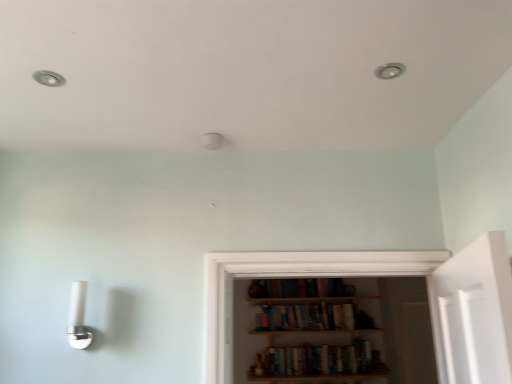
You are a GUI agent. You are given a task and a screenshot of the screen. Output one action in this format:
    pyautogui.click(x=<x>, y=<y>)
    Task: Click on the white glossy sconce at lower left
    The width and height of the screenshot is (512, 384).
    Given the screenshot: What is the action you would take?
    pyautogui.click(x=78, y=317)

Identify the location of hardcover books at center, placed as the first book when sorted from top to bottom. (309, 317).

How far apart are hardcover books at center, the 1th book ordered from the bottom, and matte white light fixture at upper left?

hardcover books at center, the 1th book ordered from the bottom, and matte white light fixture at upper left are 9.74 feet apart from each other.

Considering the relative sizes of hardcover books at center, the 1th book ordered from the bottom, and matte white light fixture at upper left in the image provided, is hardcover books at center, the 1th book ordered from the bottom, smaller than matte white light fixture at upper left?

Incorrect, hardcover books at center, the 1th book ordered from the bottom, is not smaller in size than matte white light fixture at upper left.

Which is in front, point (313, 374) or point (42, 77)?

Positioned in front is point (42, 77).

From a real-world perspective, which object stands above the other?

From a 3D spatial view, matte white light fixture at upper left is above.

I want to click on book above the hardcover books at center, marked as the 2th book in a top-to-bottom arrangement (from a real-world perspective), so click(x=309, y=317).

Are hardcover books at center, the 1th book ordered from the bottom, and hardcover books at center, the 2th book when ordered from bottom to top, far apart?

No.

Can you tell me how much hardcover books at center, marked as the 2th book in a top-to-bottom arrangement, and hardcover books at center, placed as the first book when sorted from top to bottom, differ in facing direction?

There is a 1.56-degree angle between the facing directions of hardcover books at center, marked as the 2th book in a top-to-bottom arrangement, and hardcover books at center, placed as the first book when sorted from top to bottom.

Identify the location of dot on the left of hardcover books at center, placed as the first book when sorted from top to bottom. (48, 78).

From a real-world perspective, is matte white light fixture at upper left below hardcover books at center, placed as the first book when sorted from top to bottom?

No, from a real-world perspective, matte white light fixture at upper left is not below hardcover books at center, placed as the first book when sorted from top to bottom.

Is matte white light fixture at upper left wider than hardcover books at center, the 2th book when ordered from bottom to top?

No, matte white light fixture at upper left is not wider than hardcover books at center, the 2th book when ordered from bottom to top.

Based on the photo, who is shorter, white glossy sconce at lower left or hardcover books at center, the 2th book when ordered from bottom to top?

Standing shorter between the two is hardcover books at center, the 2th book when ordered from bottom to top.

From the image's perspective, would you say white glossy sconce at lower left is positioned over hardcover books at center, placed as the first book when sorted from top to bottom?

Yes, from the image's perspective, white glossy sconce at lower left is on top of hardcover books at center, placed as the first book when sorted from top to bottom.

Is the position of white glossy sconce at lower left less distant than that of hardcover books at center, placed as the first book when sorted from top to bottom?

Yes, white glossy sconce at lower left is in front of hardcover books at center, placed as the first book when sorted from top to bottom.

Identify the location of light fixture to the left of hardcover books at center, the 2th book when ordered from bottom to top. The height and width of the screenshot is (384, 512). (78, 317).

Does point (73, 283) come closer to viewer compared to point (337, 356)?

Yes, point (73, 283) is closer to viewer.

From a real-world perspective, is white glossy sconce at lower left positioned under hardcover books at center, the 1th book ordered from the bottom, based on gravity?

No.

Between white glossy sconce at lower left and hardcover books at center, marked as the 2th book in a top-to-bottom arrangement, which one has larger size?

With larger size is hardcover books at center, marked as the 2th book in a top-to-bottom arrangement.

Based on the photo, from the image's perspective, is white glossy sconce at lower left under hardcover books at center, marked as the 2th book in a top-to-bottom arrangement?

Actually, white glossy sconce at lower left appears above hardcover books at center, marked as the 2th book in a top-to-bottom arrangement, in the image.

Considering the relative sizes of white glossy sconce at lower left and matte white light fixture at upper left in the image provided, is white glossy sconce at lower left taller than matte white light fixture at upper left?

Yes.

Is white glossy sconce at lower left positioned with its back to matte white light fixture at upper left?

No, white glossy sconce at lower left's orientation is not away from matte white light fixture at upper left.

Locate an element on the screen. light fixture behind the matte white light fixture at upper left is located at coordinates (78, 317).

Which point is more forward, (83, 333) or (36, 72)?

Point (36, 72)

Are hardcover books at center, placed as the first book when sorted from top to bottom, and matte white light fixture at upper left beside each other?

hardcover books at center, placed as the first book when sorted from top to bottom, and matte white light fixture at upper left are not in contact.

Considering the sizes of hardcover books at center, placed as the first book when sorted from top to bottom, and matte white light fixture at upper left in the image, is hardcover books at center, placed as the first book when sorted from top to bottom, bigger or smaller than matte white light fixture at upper left?

In the image, hardcover books at center, placed as the first book when sorted from top to bottom, appears to be larger than matte white light fixture at upper left.

Is point (346, 307) more distant than point (40, 83)?

Yes, it is.

From the image's perspective, which book is the 2nd one below the matte white light fixture at upper left? Please provide its 2D coordinates.

[(319, 360)]

The width and height of the screenshot is (512, 384). What are the coordinates of `book behind the hardcover books at center, the 1th book ordered from the bottom` in the screenshot? It's located at (309, 317).

Which object lies nearer to the anchor point hardcover books at center, the 1th book ordered from the bottom, white glossy sconce at lower left or hardcover books at center, the 2th book when ordered from bottom to top?

The object closer to hardcover books at center, the 1th book ordered from the bottom, is hardcover books at center, the 2th book when ordered from bottom to top.

From the picture: Which object lies further to the anchor point matte white light fixture at upper left, white glossy sconce at lower left or hardcover books at center, the 1th book ordered from the bottom?

Based on the image, hardcover books at center, the 1th book ordered from the bottom, appears to be further to matte white light fixture at upper left.

Looking at the image, which one is located closer to hardcover books at center, the 2th book when ordered from bottom to top, hardcover books at center, marked as the 2th book in a top-to-bottom arrangement, or white glossy sconce at lower left?

hardcover books at center, marked as the 2th book in a top-to-bottom arrangement.

When comparing their distances from white glossy sconce at lower left, does matte white light fixture at upper left or hardcover books at center, the 1th book ordered from the bottom, seem closer?

Based on the image, matte white light fixture at upper left appears to be nearer to white glossy sconce at lower left.

Based on the photo, looking at the image, which one is located further to hardcover books at center, the 1th book ordered from the bottom, matte white light fixture at upper left or white glossy sconce at lower left?

Based on the image, matte white light fixture at upper left appears to be further to hardcover books at center, the 1th book ordered from the bottom.

Based on their spatial positions, is hardcover books at center, the 2th book when ordered from bottom to top, or hardcover books at center, marked as the 2th book in a top-to-bottom arrangement, further from white glossy sconce at lower left?

hardcover books at center, marked as the 2th book in a top-to-bottom arrangement, lies further to white glossy sconce at lower left than the other object.

Based on their spatial positions, is hardcover books at center, the 1th book ordered from the bottom, or hardcover books at center, placed as the first book when sorted from top to bottom, closer to white glossy sconce at lower left?

Among the two, hardcover books at center, placed as the first book when sorted from top to bottom, is located nearer to white glossy sconce at lower left.

Estimate the real-world distances between objects in this image. Which object is further from matte white light fixture at upper left, hardcover books at center, marked as the 2th book in a top-to-bottom arrangement, or hardcover books at center, placed as the first book when sorted from top to bottom?

hardcover books at center, marked as the 2th book in a top-to-bottom arrangement, lies further to matte white light fixture at upper left than the other object.

Find the location of a particular element. The height and width of the screenshot is (384, 512). book between matte white light fixture at upper left and hardcover books at center, placed as the first book when sorted from top to bottom, along the z-axis is located at coordinates (319, 360).

You are a GUI agent. You are given a task and a screenshot of the screen. Output one action in this format:
    pyautogui.click(x=<x>, y=<y>)
    Task: Click on the book between white glossy sconce at lower left and hardcover books at center, placed as the first book when sorted from top to bottom, along the z-axis
    
    Given the screenshot: What is the action you would take?
    pyautogui.click(x=319, y=360)

Locate an element on the screen. light fixture positioned between matte white light fixture at upper left and hardcover books at center, the 1th book ordered from the bottom, from near to far is located at coordinates (78, 317).

In order to click on light fixture positioned between matte white light fixture at upper left and hardcover books at center, the 2th book when ordered from bottom to top, from near to far in this screenshot , I will do `click(78, 317)`.